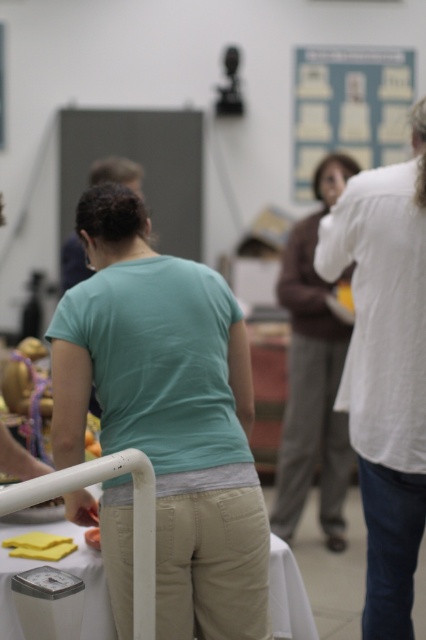
You are organizing a community event and need to arrange the teal matte shirt at center and the matte brown sweater at center on a display rack. According to the image, which one should be placed lower on the rack?

The teal matte shirt at center should be placed lower on the rack because it is positioned under the matte brown sweater at center in the image.

You are at a community event and need to place a large poster on the wall. The poster is taller than the blue paperboard at upper center. Where should you place the poster so it doesn not block the white plastic table at center?

Since the white plastic table at center is located below the blue paperboard at upper center, you should place the poster above the blue paperboard at upper center to avoid blocking the table.